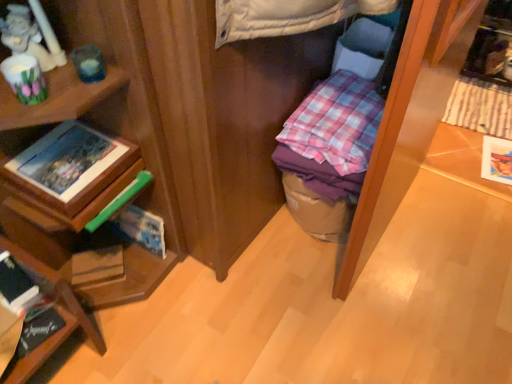
Question: Is pink checkered fabric at center with hardcover book at left, positioned as the 1th paperback book in front-to-back order?

Choices:
 (A) yes
 (B) no

Answer: (B)

Question: Can you confirm if pink checkered fabric at center is thinner than hardcover book at left, positioned as the 2th paperback book in top-to-bottom order?

Choices:
 (A) yes
 (B) no

Answer: (B)

Question: Could you tell me if pink checkered fabric at center is turned towards hardcover book at left, placed as the 2th paperback book when sorted from right to left?

Choices:
 (A) yes
 (B) no

Answer: (B)

Question: From a real-world perspective, is pink checkered fabric at center under hardcover book at left, positioned as the 2th paperback book in top-to-bottom order?

Choices:
 (A) yes
 (B) no

Answer: (B)

Question: Is pink checkered fabric at center outside hardcover book at left, which is the third paperback book from back to front?

Choices:
 (A) yes
 (B) no

Answer: (A)

Question: Considering the relative sizes of pink checkered fabric at center and hardcover book at left, positioned as the 1th paperback book in front-to-back order, in the image provided, is pink checkered fabric at center smaller than hardcover book at left, positioned as the 1th paperback book in front-to-back order,?

Choices:
 (A) yes
 (B) no

Answer: (B)

Question: From the image's perspective, is hardcover book at lower left, which is the first book from bottom to top, beneath matte brown book at lower left, which is the second paperback book in front-to-back order?

Choices:
 (A) yes
 (B) no

Answer: (A)

Question: Is hardcover book at lower left, the third book when ordered from top to bottom, wider than matte brown book at lower left, which ranks as the first paperback book in bottom-to-top order?

Choices:
 (A) no
 (B) yes

Answer: (B)

Question: Can you confirm if hardcover book at lower left, the third book when ordered from top to bottom, is positioned to the right of matte brown book at lower left, which is the second paperback book in front-to-back order?

Choices:
 (A) yes
 (B) no

Answer: (B)

Question: Would you say matte brown book at lower left, which is the second paperback book in front-to-back order, is part of hardcover book at lower left, which is the first book from bottom to top,'s contents?

Choices:
 (A) yes
 (B) no

Answer: (B)

Question: Would you say hardcover book at lower left, the third book when ordered from top to bottom, is a long distance from matte brown book at lower left, which is the second paperback book in front-to-back order?

Choices:
 (A) yes
 (B) no

Answer: (B)

Question: Can you confirm if hardcover book at lower left, which is the first book from bottom to top, is positioned to the left of matte brown book at lower left, which appears as the second paperback book when viewed from the back?

Choices:
 (A) no
 (B) yes

Answer: (B)

Question: Are wooden photo frame at left, arranged as the 1th book when viewed from the top, and hardcover book at lower left, the 2th book in the top-to-bottom sequence, making contact?

Choices:
 (A) no
 (B) yes

Answer: (A)